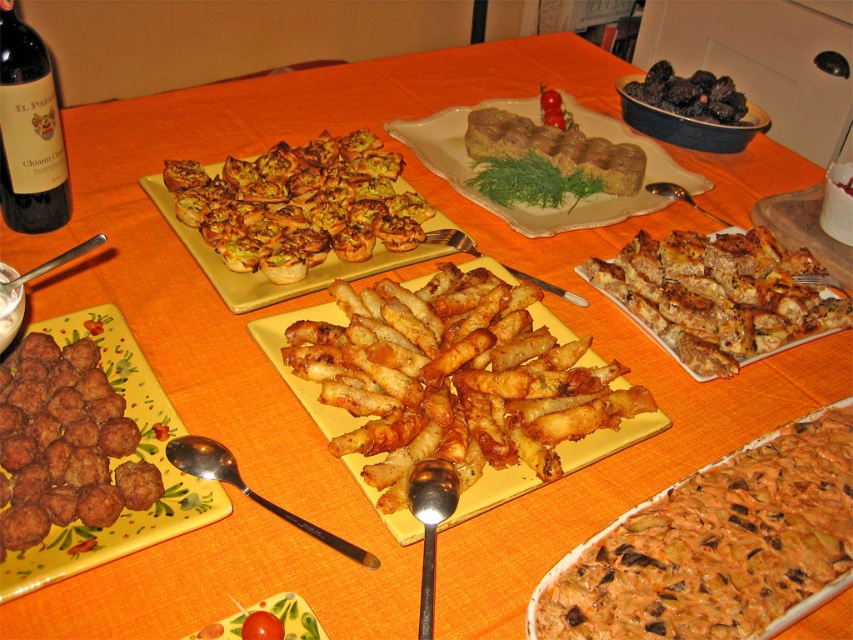
You are a guest at a buffet and want to try both the brown crumbly meatballs at lower left and the brown crumbly bread at center right. However, you can only reach one dish at a time. Based on their positions, which dish can you reach first without moving your chair?

The brown crumbly meatballs at lower left can be reached first because it is positioned in front of the brown crumbly bread at center right, making it closer to your current position.

What is located at the coordinate point (64,444) in the image?

The coordinate point (64,444) corresponds to the brown crumbly meatballs at lower left.

You are a guest at a buffet and want to choose between the brown crumbly meatballs at lower left and the brown crumbly bread at center right. Which option is more suitable if you prefer something thicker?

The brown crumbly bread at center right is thicker than the brown crumbly meatballs at lower left, so it is more suitable for someone who prefers something thicker.